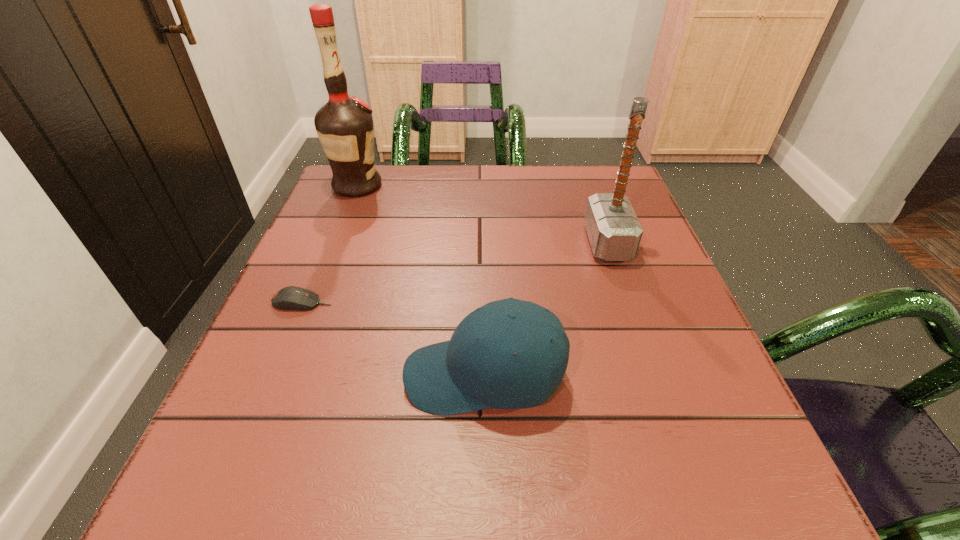
Where is `the farthest object`? the farthest object is located at coordinates (344, 125).

Find the location of a particular element. The height and width of the screenshot is (540, 960). liquor is located at coordinates tap(344, 125).

Find the location of a particular element. This screenshot has width=960, height=540. the rightmost object is located at coordinates (614, 231).

Where is `the second farthest object`? This screenshot has width=960, height=540. the second farthest object is located at coordinates (614, 231).

This screenshot has height=540, width=960. I want to click on the nearest object, so click(x=476, y=369).

Where is `the second object from right to left`? This screenshot has height=540, width=960. the second object from right to left is located at coordinates (476, 369).

Locate an element on the screen. Image resolution: width=960 pixels, height=540 pixels. the shortest object is located at coordinates (289, 298).

You are a GUI agent. You are given a task and a screenshot of the screen. Output one action in this format:
    pyautogui.click(x=<x>, y=<y>)
    Task: Click on the second nearest object
    
    Given the screenshot: What is the action you would take?
    pyautogui.click(x=289, y=298)

Image resolution: width=960 pixels, height=540 pixels. What are the coordinates of `vacant space located 0.110m on the front and back of the liquor` in the screenshot? It's located at (425, 186).

At what (x,y) coordinates should I click in order to perform the action: click on vacant region located on the striking surface of the rightmost object. Please return your answer as a coordinate pair (x, y). The height and width of the screenshot is (540, 960). Looking at the image, I should click on (458, 243).